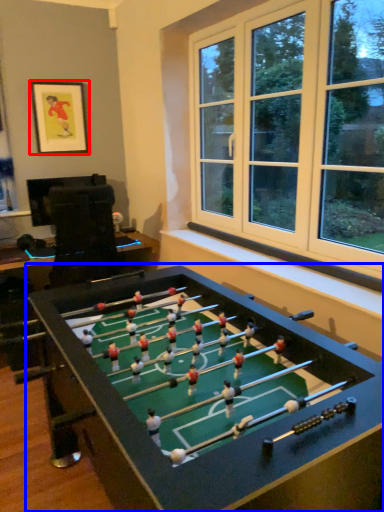
Question: Among these objects, which one is farthest to the camera, picture frame (highlighted by a red box) or table (highlighted by a blue box)?

Choices:
 (A) picture frame
 (B) table

Answer: (A)